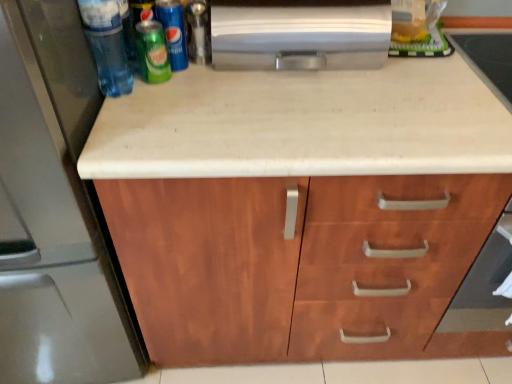
Locate an element on the screen. The image size is (512, 384). vacant area located to the right-hand side of green matte pepsi can at upper left, acting as the 1th beer starting from the right is located at coordinates (246, 81).